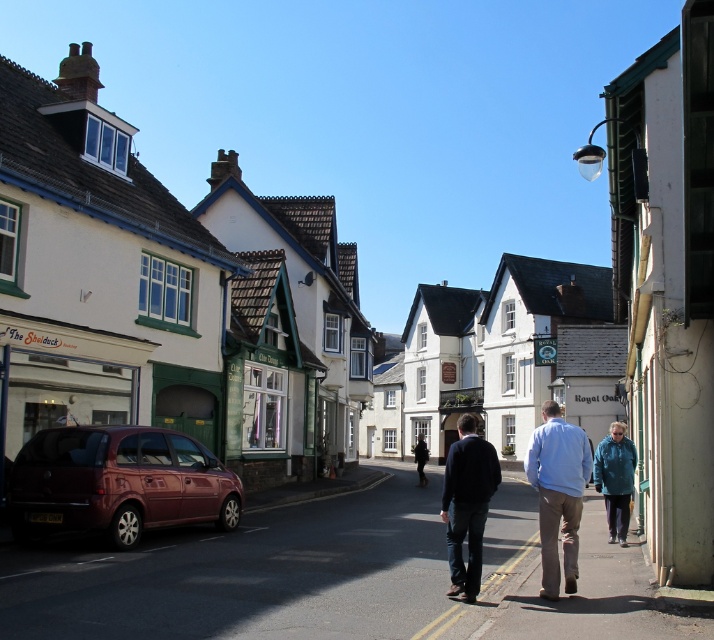
You are a delivery person trying to park your shiny maroon hatchback at lower left in the parking spot next to the shop named The Shelduck. However, there is already a metallic car at lower left occupying part of the spot. Can your shiny maroon hatchback still fit into the remaining space?

The metallic car at lower left is larger in size than the shiny maroon hatchback at lower left. Since the metallic car is taking up part of the parking spot, there might still be enough space for the smaller shiny maroon hatchback to fit, but it depends on how much of the spot the larger car is occupying.

You are a delivery person standing at the entrance of The Shelduck shop. You need to place a package between the blue fabric jacket at center and the dark blue sweater at center. The package is 3 feet wide. Is there enough space between them to place the package?

The blue fabric jacket at center and dark blue sweater at center are 7.75 feet apart from each other. Since the package is 3 feet wide, there is sufficient space between them to place the package.